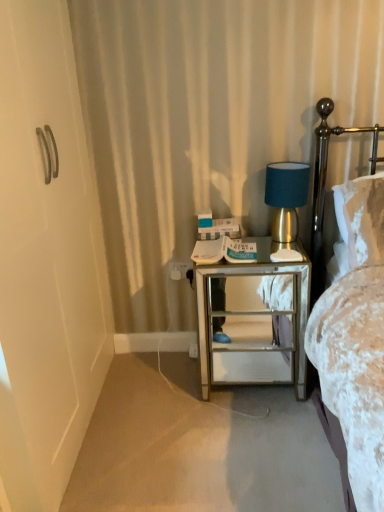
The image size is (384, 512). Identify the location of vacant space situated on the left part of clear glass nightstand at center. (171, 393).